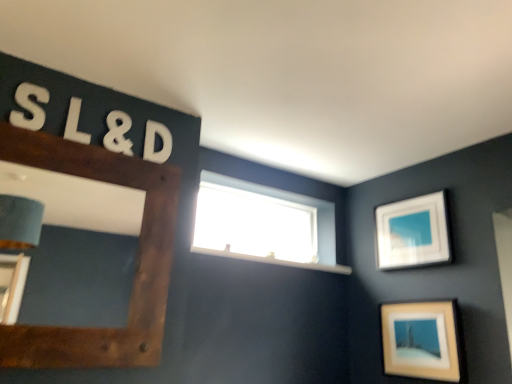
I want to click on transparent glass window at upper center, so click(264, 224).

In order to face white foam letter l at upper left, which is counted as the 1th letter, starting from the front, should I rotate leftwards or rightwards?

You should rotate left by 22.411 degrees.

How much space does white foam letter l at upper left, which is counted as the 1th letter, starting from the front, occupy vertically?

The height of white foam letter l at upper left, which is counted as the 1th letter, starting from the front, is 8.36 inches.

The width and height of the screenshot is (512, 384). Describe the element at coordinates (29, 106) in the screenshot. I see `white foam letter s at upper left, which is the second number in right-to-left order` at that location.

The width and height of the screenshot is (512, 384). I want to click on white foam ampersand at upper left, the 2th number from the left, so click(x=118, y=133).

Describe the element at coordinates (118, 133) in the screenshot. I see `white foam ampersand at upper left, the 1th number in the back-to-front sequence` at that location.

Find the location of a particular element. white matte letter d at upper center, which is the first letter in back-to-front order is located at coordinates (154, 142).

In terms of width, does white matte letter d at upper center, which is the second letter from left to right, look wider or thinner when compared to white foam letter l at upper left, which is the 2th letter in right-to-left order?

Considering their sizes, white matte letter d at upper center, which is the second letter from left to right, looks slimmer than white foam letter l at upper left, which is the 2th letter in right-to-left order.

Identify the location of letter above the white matte letter d at upper center, which is the 2th letter from front to back (from the image's perspective). (75, 123).

Considering the relative positions of white matte letter d at upper center, which is the second letter from left to right, and white foam letter l at upper left, which is the 2th letter in right-to-left order, in the image provided, is white matte letter d at upper center, which is the second letter from left to right, to the left or to the right of white foam letter l at upper left, which is the 2th letter in right-to-left order,?

white matte letter d at upper center, which is the second letter from left to right, is to the right of white foam letter l at upper left, which is the 2th letter in right-to-left order.

From a real-world perspective, is transparent glass window at upper center on white foam ampersand at upper left, the 1th number in the back-to-front sequence?

No, from a real-world perspective, transparent glass window at upper center is not on top of white foam ampersand at upper left, the 1th number in the back-to-front sequence.

In the scene shown: Are transparent glass window at upper center and white foam ampersand at upper left, which appears as the first number when viewed from the right, far apart?

Absolutely, transparent glass window at upper center is distant from white foam ampersand at upper left, which appears as the first number when viewed from the right.

Does transparent glass window at upper center have a greater width compared to white foam ampersand at upper left, which is the 2th number from front to back?

Correct, the width of transparent glass window at upper center exceeds that of white foam ampersand at upper left, which is the 2th number from front to back.

Does transparent glass window at upper center contain white foam ampersand at upper left, the 2th number from the left?

No, white foam ampersand at upper left, the 2th number from the left, is not inside transparent glass window at upper center.

You are a GUI agent. You are given a task and a screenshot of the screen. Output one action in this format:
    pyautogui.click(x=<x>, y=<y>)
    Task: Click on the 1st picture frame located beneath the white matte letter d at upper center, which is the 2th letter from front to back (from a real-world perspective)
    This screenshot has height=384, width=512.
    Given the screenshot: What is the action you would take?
    pyautogui.click(x=412, y=232)

Is white matte picture frame at upper right, placed as the 1th picture frame when sorted from right to left, surrounding white matte letter d at upper center, placed as the 1th letter when sorted from right to left?

No, white matte letter d at upper center, placed as the 1th letter when sorted from right to left, is not inside white matte picture frame at upper right, placed as the 1th picture frame when sorted from right to left.

Can you confirm if white matte picture frame at upper right, the first picture frame viewed from the back, is positioned to the right of white matte letter d at upper center, which is the second letter from left to right?

Indeed, white matte picture frame at upper right, the first picture frame viewed from the back, is positioned on the right side of white matte letter d at upper center, which is the second letter from left to right.

What's the angular difference between white matte picture frame at upper right, placed as the 1th picture frame when sorted from right to left, and white matte letter d at upper center, placed as the 1th letter when sorted from right to left,'s facing directions?

The angle between the facing direction of white matte picture frame at upper right, placed as the 1th picture frame when sorted from right to left, and the facing direction of white matte letter d at upper center, placed as the 1th letter when sorted from right to left, is 89 degrees.

Is matte white picture frame at lower right, the second picture frame when ordered from right to left, a part of brown wooden picture frame at left, arranged as the 3th picture frame when viewed from the back?

No, brown wooden picture frame at left, arranged as the 3th picture frame when viewed from the back, does not contain matte white picture frame at lower right, the second picture frame when ordered from right to left.

Which of these two, brown wooden picture frame at left, arranged as the 3th picture frame when viewed from the back, or matte white picture frame at lower right, marked as the 2th picture frame in a back-to-front arrangement, is wider?

Wider between the two is matte white picture frame at lower right, marked as the 2th picture frame in a back-to-front arrangement.

Considering the positions of points (143, 319) and (439, 341), is point (143, 319) closer to camera compared to point (439, 341)?

Yes, it is.

Is brown wooden picture frame at left, the 1th picture frame from the front, placed right next to matte white picture frame at lower right, the second picture frame from the front?

There is a gap between brown wooden picture frame at left, the 1th picture frame from the front, and matte white picture frame at lower right, the second picture frame from the front.

Considering the sizes of objects white foam letter l at upper left, the first letter in the left-to-right sequence, and brown wooden picture frame at left, arranged as the 3th picture frame when viewed from the back, in the image provided, who is wider, white foam letter l at upper left, the first letter in the left-to-right sequence, or brown wooden picture frame at left, arranged as the 3th picture frame when viewed from the back,?

white foam letter l at upper left, the first letter in the left-to-right sequence, is wider.

Measure the distance from white foam letter l at upper left, the 2th letter positioned from the back, to brown wooden picture frame at left, which appears as the first picture frame when viewed from the left.

17.13 inches.

Considering their positions, is white foam letter l at upper left, the 2th letter positioned from the back, located in front of or behind brown wooden picture frame at left, the 3th picture frame when ordered from right to left?

white foam letter l at upper left, the 2th letter positioned from the back, is positioned farther from the viewer than brown wooden picture frame at left, the 3th picture frame when ordered from right to left.

From the image's perspective, is white foam letter l at upper left, which is counted as the 1th letter, starting from the front, above or below brown wooden picture frame at left, the 1th picture frame from the front?

white foam letter l at upper left, which is counted as the 1th letter, starting from the front, is above brown wooden picture frame at left, the 1th picture frame from the front.

At what (x,y) coordinates should I click in order to perform the action: click on picture frame directly beneath the brown wooden picture frame at left, arranged as the 3th picture frame when viewed from the back (from a real-world perspective). Please return your answer as a coordinate pair (x, y). This screenshot has height=384, width=512. Looking at the image, I should click on (421, 340).

From the image's perspective, who appears lower, matte white picture frame at lower right, the second picture frame from the front, or brown wooden picture frame at left, the 3th picture frame when ordered from right to left?

matte white picture frame at lower right, the second picture frame from the front.

Based on their sizes in the image, would you say matte white picture frame at lower right, marked as the 2th picture frame in a back-to-front arrangement, is bigger or smaller than brown wooden picture frame at left, the 1th picture frame from the front?

In the image, matte white picture frame at lower right, marked as the 2th picture frame in a back-to-front arrangement, appears to be smaller than brown wooden picture frame at left, the 1th picture frame from the front.

Between matte white picture frame at lower right, marked as the 2th picture frame in a back-to-front arrangement, and white matte letter d at upper center, which is the first letter in back-to-front order, which one has smaller width?

white matte letter d at upper center, which is the first letter in back-to-front order.

How distant is matte white picture frame at lower right, placed as the 2th picture frame when sorted from left to right, from white matte letter d at upper center, placed as the 1th letter when sorted from right to left?

matte white picture frame at lower right, placed as the 2th picture frame when sorted from left to right, is 5.61 feet away from white matte letter d at upper center, placed as the 1th letter when sorted from right to left.

Which of these two, matte white picture frame at lower right, placed as the 2th picture frame when sorted from left to right, or white matte letter d at upper center, placed as the 1th letter when sorted from right to left, stands taller?

With more height is matte white picture frame at lower right, placed as the 2th picture frame when sorted from left to right.

Is point (403, 332) positioned in front of point (145, 156)?

No, it is behind (145, 156).

This screenshot has width=512, height=384. What are the coordinates of `letter located above the white matte letter d at upper center, which is the second letter from left to right (from the image's perspective)` in the screenshot? It's located at (75, 123).

Where is `number that is the 2nd object above the transparent glass window at upper center (from a real-world perspective)`? number that is the 2nd object above the transparent glass window at upper center (from a real-world perspective) is located at coordinates pos(118,133).

From the image, which object appears to be farther from transparent glass window at upper center, white foam ampersand at upper left, the 1th number in the back-to-front sequence, or matte white picture frame at lower right, marked as the 2th picture frame in a back-to-front arrangement?

The object further to transparent glass window at upper center is white foam ampersand at upper left, the 1th number in the back-to-front sequence.

Estimate the real-world distances between objects in this image. Which object is further from transparent glass window at upper center, white matte picture frame at upper right, positioned as the third picture frame in left-to-right order, or white foam letter l at upper left, which is counted as the 1th letter, starting from the front?

white foam letter l at upper left, which is counted as the 1th letter, starting from the front, is further to transparent glass window at upper center.

Considering their positions, is white matte letter d at upper center, which is the second letter from left to right, positioned closer to white foam letter s at upper left, positioned as the 2th number in back-to-front order, than brown wooden picture frame at left, the 1th picture frame from the front?

Result: Among the two, brown wooden picture frame at left, the 1th picture frame from the front, is located nearer to white foam letter s at upper left, positioned as the 2th number in back-to-front order.

Looking at this image, which object lies nearer to the anchor point transparent glass window at upper center, white matte letter d at upper center, placed as the 1th letter when sorted from right to left, or white matte picture frame at upper right, placed as the 1th picture frame when sorted from right to left?

white matte picture frame at upper right, placed as the 1th picture frame when sorted from right to left, is positioned closer to the anchor transparent glass window at upper center.

Based on their spatial positions, is white matte letter d at upper center, which is the second letter from left to right, or white foam ampersand at upper left, the 2th number from the left, further from matte white picture frame at lower right, marked as the 2th picture frame in a back-to-front arrangement?

The object further to matte white picture frame at lower right, marked as the 2th picture frame in a back-to-front arrangement, is white foam ampersand at upper left, the 2th number from the left.

Based on their spatial positions, is transparent glass window at upper center or brown wooden picture frame at left, arranged as the 3th picture frame when viewed from the back, closer to matte white picture frame at lower right, the second picture frame from the front?

The object closer to matte white picture frame at lower right, the second picture frame from the front, is transparent glass window at upper center.

From the image, which object appears to be nearer to white matte picture frame at upper right, the first picture frame viewed from the back, white foam letter l at upper left, which is counted as the 1th letter, starting from the front, or white foam letter s at upper left, which is the second number in right-to-left order?

white foam letter l at upper left, which is counted as the 1th letter, starting from the front, lies closer to white matte picture frame at upper right, the first picture frame viewed from the back, than the other object.

Estimate the real-world distances between objects in this image. Which object is further from white foam ampersand at upper left, which is the 2th number from front to back, matte white picture frame at lower right, the second picture frame from the front, or white matte letter d at upper center, which is the 2th letter from front to back?

Based on the image, matte white picture frame at lower right, the second picture frame from the front, appears to be further to white foam ampersand at upper left, which is the 2th number from front to back.

The image size is (512, 384). What are the coordinates of `number between white foam letter l at upper left, which is counted as the 1th letter, starting from the front, and brown wooden picture frame at left, the 1th picture frame from the front, in the vertical direction` in the screenshot? It's located at (118, 133).

Find the location of `window between white matte letter d at upper center, which is the second letter from left to right, and matte white picture frame at lower right, marked as the 2th picture frame in a back-to-front arrangement`. window between white matte letter d at upper center, which is the second letter from left to right, and matte white picture frame at lower right, marked as the 2th picture frame in a back-to-front arrangement is located at coordinates (264, 224).

In order to click on letter between white foam ampersand at upper left, the 2th number from the left, and transparent glass window at upper center in the front-back direction in this screenshot , I will do `click(154, 142)`.

Where is `number between white foam letter s at upper left, positioned as the 1th number in left-to-right order, and white matte picture frame at upper right, the first picture frame viewed from the back, in the horizontal direction`? The width and height of the screenshot is (512, 384). number between white foam letter s at upper left, positioned as the 1th number in left-to-right order, and white matte picture frame at upper right, the first picture frame viewed from the back, in the horizontal direction is located at coordinates (118, 133).